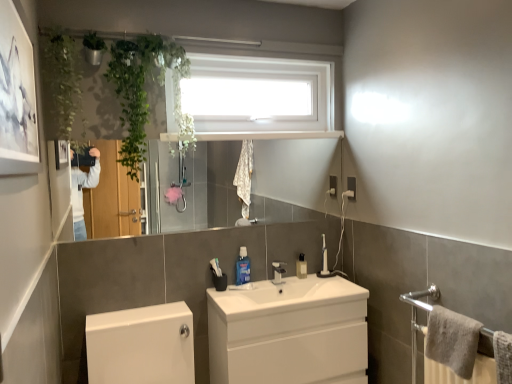
At what (x,y) coordinates should I click in order to perform the action: click on empty space that is ontop of metallic silver mirror at upper center. Please return your answer as a coordinate pair (x, y). Looking at the image, I should click on (178, 133).